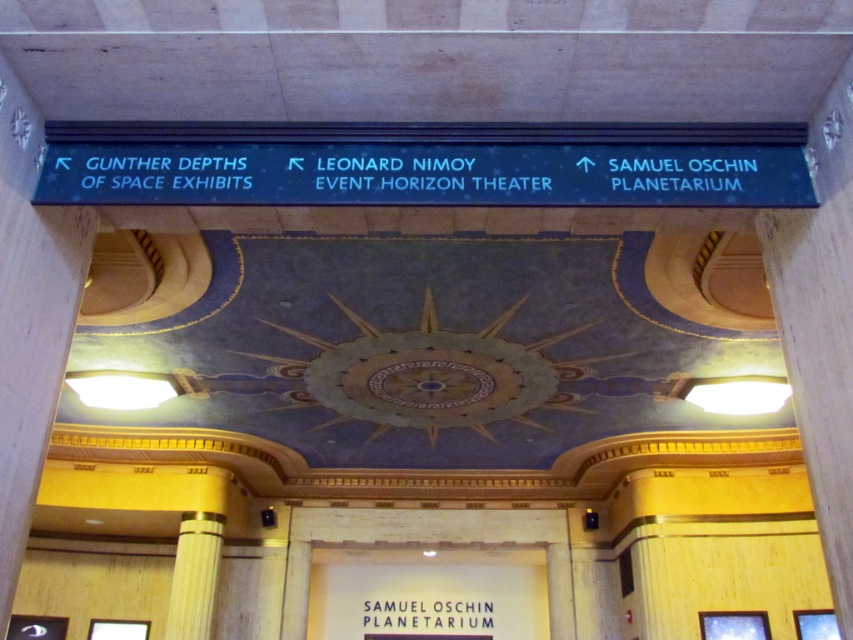
Question: Is wooden pillar at center to the left of black matte samuel oschin planetarium at center from the viewer's perspective?

Choices:
 (A) no
 (B) yes

Answer: (B)

Question: Can you confirm if blue glossy sign at upper center is positioned to the left of black matte samuel oschin planetarium at center?

Choices:
 (A) yes
 (B) no

Answer: (B)

Question: Which point is farther from the camera taking this photo?

Choices:
 (A) (231, 196)
 (B) (201, 584)

Answer: (B)

Question: Estimate the real-world distances between objects in this image. Which object is closer to the blue glossy sign at upper center?

Choices:
 (A) black matte samuel oschin planetarium at center
 (B) wooden pillar at center

Answer: (B)

Question: In this image, where is blue glossy sign at upper center located relative to wooden pillar at center?

Choices:
 (A) left
 (B) right

Answer: (B)

Question: Which object is positioned closest to the wooden pillar at center?

Choices:
 (A) black matte samuel oschin planetarium at center
 (B) blue glossy sign at upper center

Answer: (A)